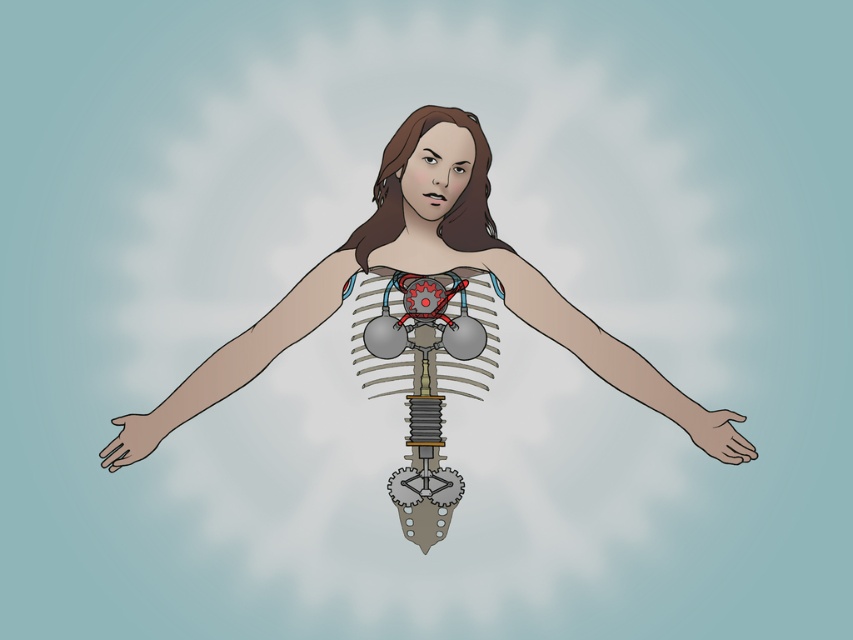
Is the position of smooth skin arm at left less distant than that of matte gray hand at lower left?

Yes, smooth skin arm at left is closer to the viewer.

Who is lower down, smooth skin arm at left or matte gray hand at lower left?

matte gray hand at lower left is below.

Describe the element at coordinates (236, 358) in the screenshot. I see `smooth skin arm at left` at that location.

The image size is (853, 640). In order to click on smooth skin arm at left in this screenshot , I will do `click(236, 358)`.

Which is in front, point (379, 301) or point (439, 516)?

Point (439, 516) is in front.

Is metallic mechanical girl at center positioned in front of metallic gear at center?

Yes, metallic mechanical girl at center is closer to the viewer.

Between point (460, 163) and point (483, 321), which one is positioned behind?

Positioned behind is point (483, 321).

Find the location of a particular element. Image resolution: width=853 pixels, height=640 pixels. metallic mechanical girl at center is located at coordinates (425, 305).

Does point (389, 209) come farther from viewer compared to point (334, 259)?

Yes, it is behind point (334, 259).

Between point (415, 157) and point (190, 378), which one is positioned in front?

Point (415, 157) is more forward.

What do you see at coordinates (425, 305) in the screenshot?
I see `metallic mechanical girl at center` at bounding box center [425, 305].

Locate an element on the screen. metallic mechanical girl at center is located at coordinates (425, 305).